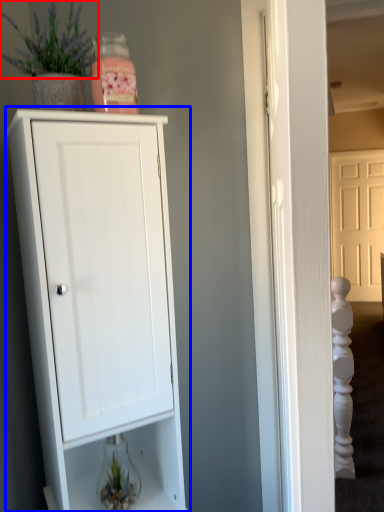
Question: Which of the following is the farthest to the observer, plant (highlighted by a red box) or cupboard (highlighted by a blue box)?

Choices:
 (A) plant
 (B) cupboard

Answer: (A)